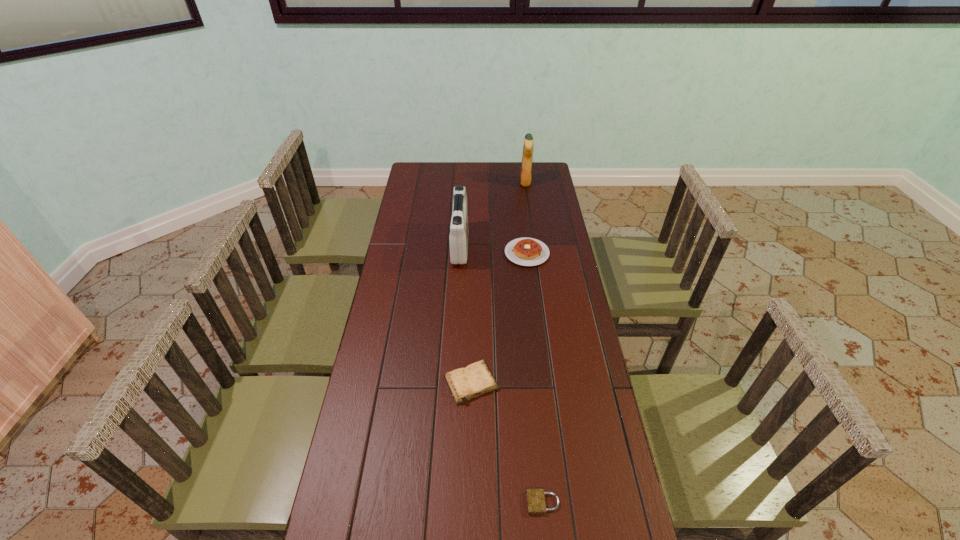
The image size is (960, 540). Find the location of `the farthest object`. the farthest object is located at coordinates (525, 175).

In order to click on the second tallest object in this screenshot , I will do `click(458, 238)`.

Find the location of a particular element. The height and width of the screenshot is (540, 960). the third shortest object is located at coordinates (525, 251).

Where is `the second nearest object`? The width and height of the screenshot is (960, 540). the second nearest object is located at coordinates (476, 379).

Where is `diary`? Image resolution: width=960 pixels, height=540 pixels. diary is located at coordinates (476, 379).

Locate an element on the screen. Image resolution: width=960 pixels, height=540 pixels. the nearest object is located at coordinates (536, 504).

The image size is (960, 540). I want to click on padlock, so (536, 504).

The height and width of the screenshot is (540, 960). I want to click on free space located 0.080m on the label of the farthest object, so click(x=504, y=183).

Identify the location of vacant point located 0.340m on the label of the farthest object. Image resolution: width=960 pixels, height=540 pixels. (452, 183).

Find the location of a particular element. This screenshot has height=540, width=960. vacant area situated 0.270m on the label of the farthest object is located at coordinates [467, 183].